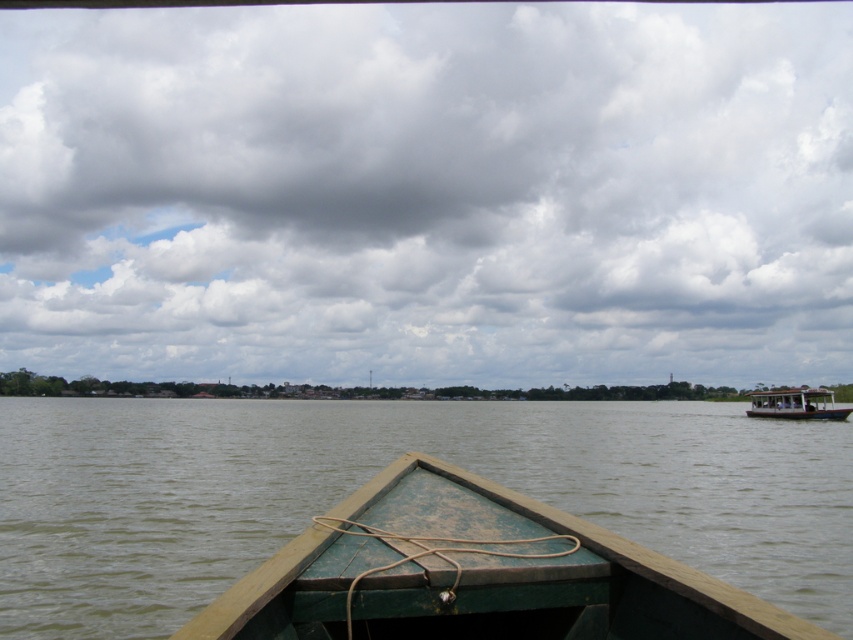
You are an observer sitting in the green weathered wood boat at center and want to know if your boat is narrower than the white wooden boat at right. Can you determine this based on the scene?

The green weathered wood boat at center is thinner than white wooden boat at right, so yes, your boat is narrower than the white wooden boat at right.

You are an observer in a boat and want to know if the cloudy sky at upper center is wider than the white wooden boat at right. Can you determine this based on the scene?

The cloudy sky at upper center might be wider than the white wooden boat at right according to the description.